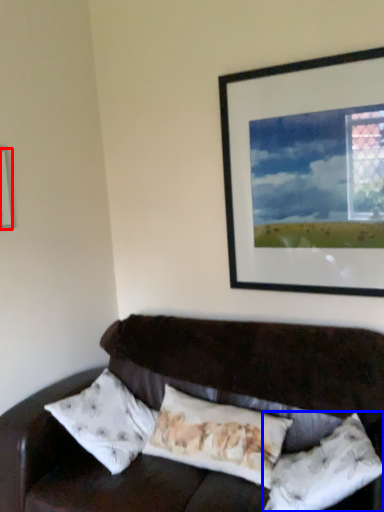
Question: Among these objects, which one is nearest to the camera, picture frame (highlighted by a red box) or pillow (highlighted by a blue box)?

Choices:
 (A) picture frame
 (B) pillow

Answer: (B)